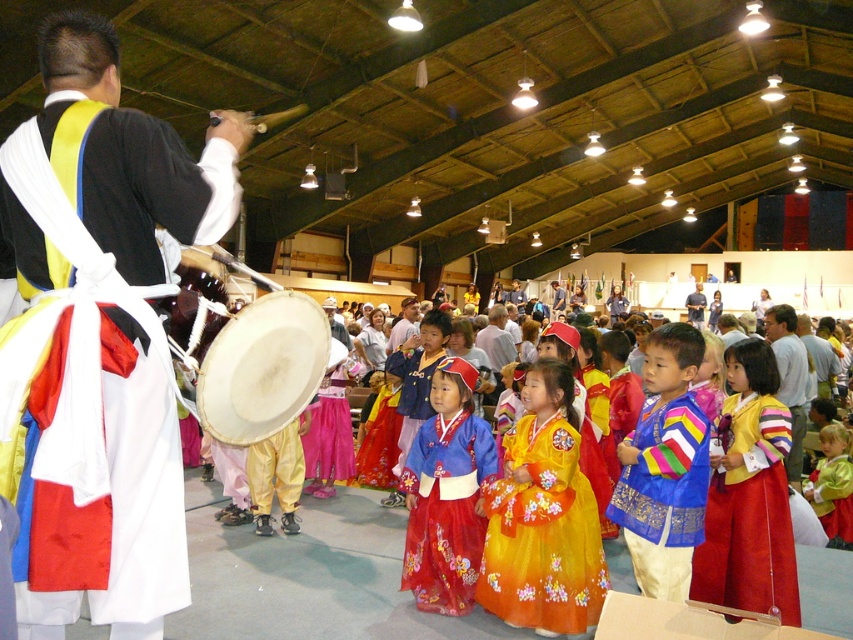
Looking at this image, you are a photographer standing at the back of the hall. You want to take a photo of both the floral silk dress at center and the blue denim shirt at center in the same frame. Given that your camera has a maximum focus range of 20 meters, will you be able to capture both subjects clearly in one shot?

The floral silk dress at center is 19.13 meters from the blue denim shirt at center. Since the maximum focus range of the camera is 20 meters, the distance between them is within the range, so yes, you can capture both subjects clearly in one shot.

You are standing at the entrance of the hall and see two points marked in the scene. The first point is at coordinate point (509, 548) and the second is at point (402, 342). Which point is closer to you?

Point (509, 548) is in front of point (402, 342), so it is closer to you.